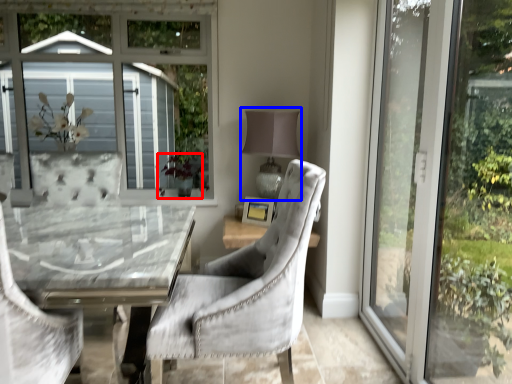
Question: Which point is closer to the camera, plant (highlighted by a red box) or table lamp (highlighted by a blue box)?

Choices:
 (A) plant
 (B) table lamp

Answer: (B)